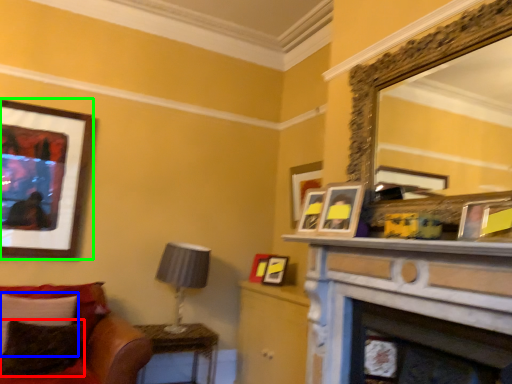
Question: Considering the real-world distances, which object is farthest from pillow (highlighted by a red box)? pillow (highlighted by a blue box) or picture frame (highlighted by a green box)?

Choices:
 (A) pillow
 (B) picture frame

Answer: (B)